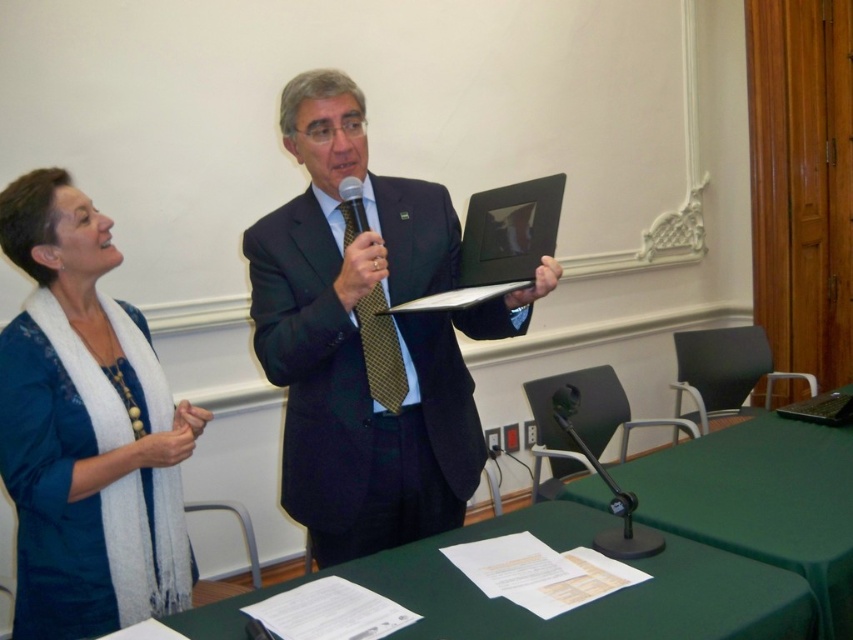
Can you confirm if white knit scarf at upper left is wider than gold textured tie at center?

Indeed, white knit scarf at upper left has a greater width compared to gold textured tie at center.

Who is positioned more to the left, white knit scarf at upper left or gold textured tie at center?

white knit scarf at upper left is more to the left.

Which is behind, point (94, 481) or point (374, 371)?

Positioned behind is point (374, 371).

At what (x,y) coordinates should I click in order to perform the action: click on white knit scarf at upper left. Please return your answer as a coordinate pair (x, y). The width and height of the screenshot is (853, 640). Looking at the image, I should click on (84, 429).

Does green fabric table at lower center have a larger size compared to gold textured tie at center?

Correct, green fabric table at lower center is larger in size than gold textured tie at center.

Who is positioned more to the left, green fabric table at lower center or gold textured tie at center?

gold textured tie at center

Is point (270, 586) closer to camera compared to point (344, 209)?

Yes.

At what (x,y) coordinates should I click in order to perform the action: click on green fabric table at lower center. Please return your answer as a coordinate pair (x, y). Image resolution: width=853 pixels, height=640 pixels. Looking at the image, I should click on (572, 611).

Who is positioned more to the left, white knit scarf at upper left or green fabric table at lower right?

white knit scarf at upper left is more to the left.

Does white knit scarf at upper left appear on the left side of green fabric table at lower right?

Yes, white knit scarf at upper left is to the left of green fabric table at lower right.

Measure the distance between white knit scarf at upper left and camera.

They are 4.74 feet apart.

Find the location of a particular element. white knit scarf at upper left is located at coordinates (84, 429).